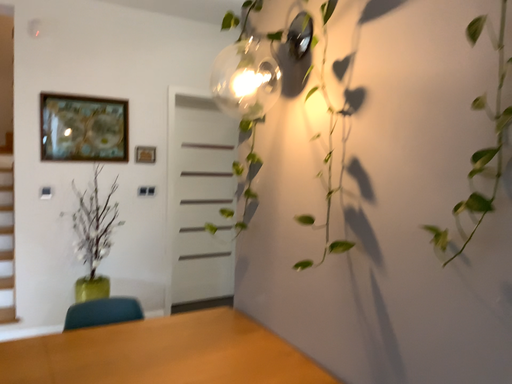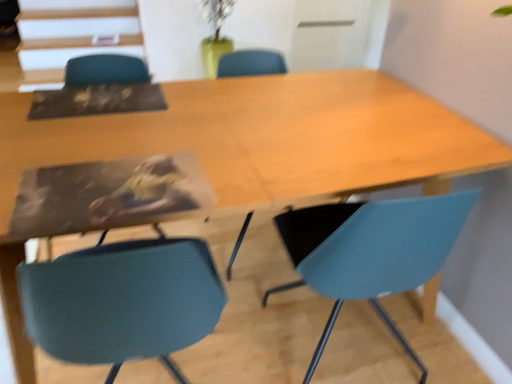
Question: Which way did the camera rotate in the video?

Choices:
 (A) rotated right
 (B) rotated left

Answer: (B)